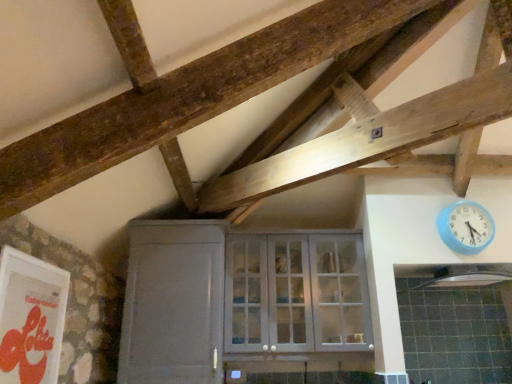
Question: From their relative heights in the image, would you say white matte door at lower left is taller or shorter than white glass cabinet at center?

Choices:
 (A) short
 (B) tall

Answer: (B)

Question: Do you think white matte door at lower left is within white glass cabinet at center, or outside of it?

Choices:
 (A) outside
 (B) inside

Answer: (A)

Question: Which is nearer to the white glass cabinet at center?

Choices:
 (A) blue plastic wall clock at upper right
 (B) black matte exhaust hood at upper right
 (C) white matte door at lower left

Answer: (C)

Question: Considering the real-world distances, which object is closest to the white glass cabinet at center?

Choices:
 (A) white matte door at lower left
 (B) black matte exhaust hood at upper right
 (C) blue plastic wall clock at upper right

Answer: (A)